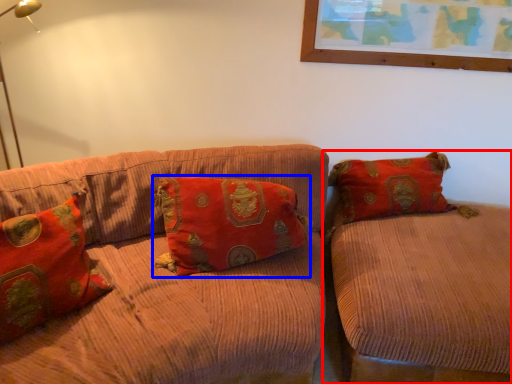
Question: Which object is further to the camera taking this photo, studio couch (highlighted by a red box) or pillow (highlighted by a blue box)?

Choices:
 (A) studio couch
 (B) pillow

Answer: (B)